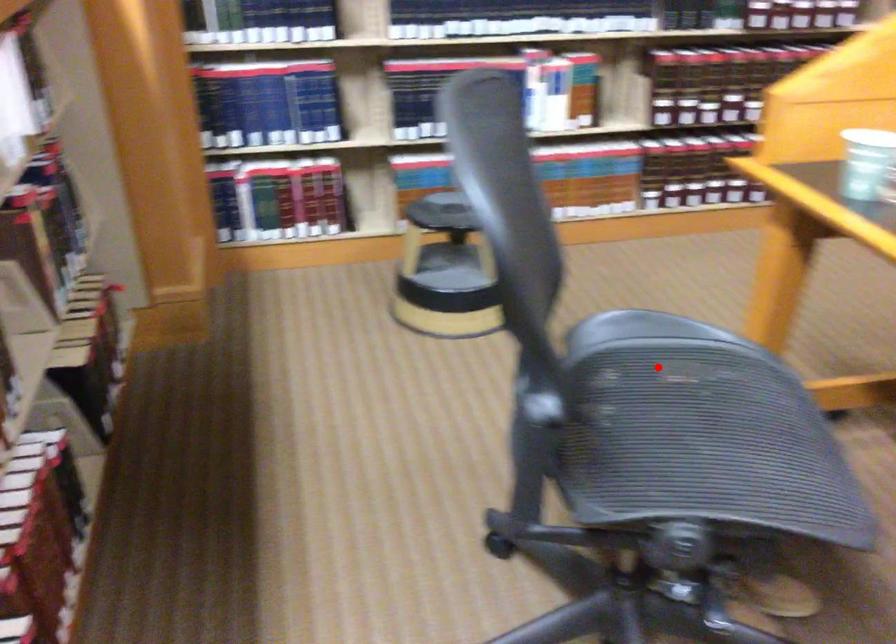
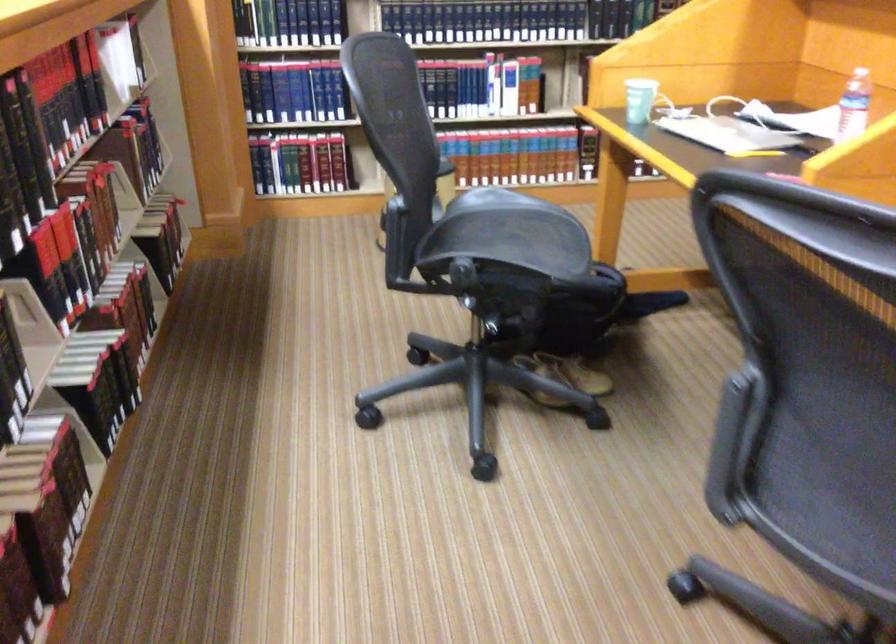
Find the pixel in the second image that matches the highlighted location in the first image.

(500, 221)